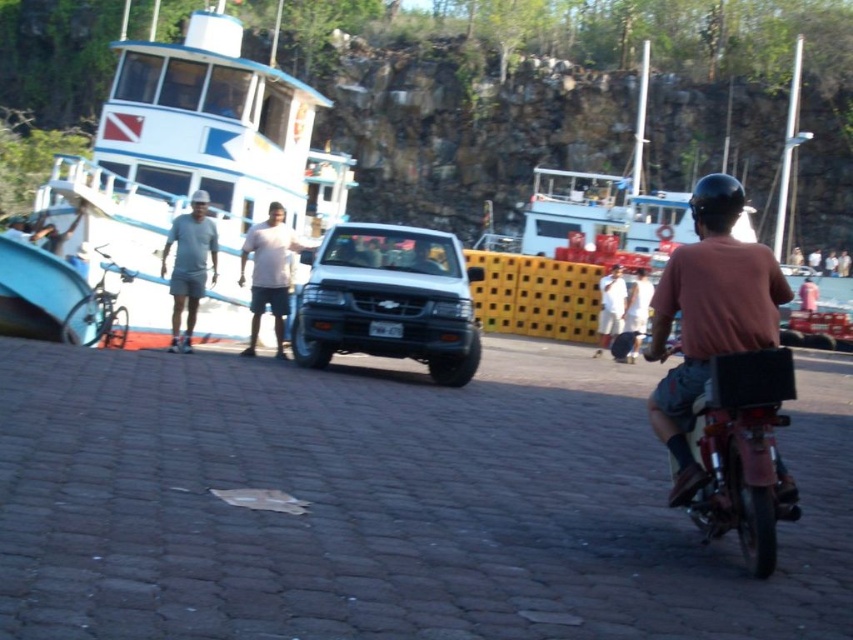
Question: Is metallic red motorcycle at right positioned at the back of shiny silver bicycle at left?

Choices:
 (A) yes
 (B) no

Answer: (B)

Question: Which of the following is the farthest from the observer?

Choices:
 (A) (608, 298)
 (B) (189, 285)
 (C) (204, 12)

Answer: (A)

Question: Which point is farther to the camera?

Choices:
 (A) (460, 376)
 (B) (770, 538)
 (C) (84, 237)

Answer: (C)

Question: Does white glossy boat at upper left have a greater width compared to brown matte shirt at right?

Choices:
 (A) no
 (B) yes

Answer: (B)

Question: Which point is closer to the camera?

Choices:
 (A) metallic red motorcycle at right
 (B) white glossy boat at upper left

Answer: (A)

Question: Does light pink cotton shirt at center appear on the left side of gray fabric shorts at left?

Choices:
 (A) no
 (B) yes

Answer: (A)